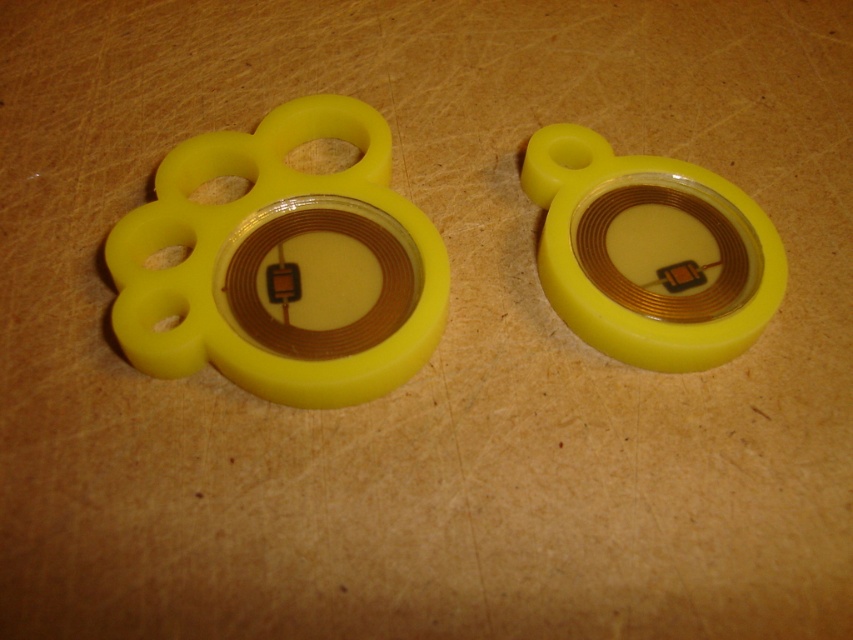
Between matte yellow paw at center and yellow matte/soft toy at right, which one is positioned higher?

yellow matte/soft toy at right is higher up.

Is the position of matte yellow paw at center less distant than that of yellow matte/soft toy at right?

That is True.

What do you see at coordinates (283, 260) in the screenshot? I see `matte yellow paw at center` at bounding box center [283, 260].

Where is `matte yellow paw at center`? matte yellow paw at center is located at coordinates (283, 260).